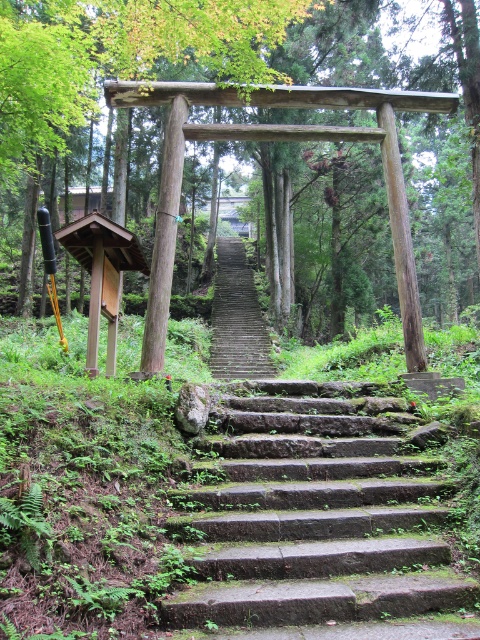
Question: Does green mossy stone stairs at center have a lesser width compared to green wood tree at center?

Choices:
 (A) yes
 (B) no

Answer: (A)

Question: Is green mossy stone stairs at center further to the viewer compared to green wood tree at center?

Choices:
 (A) yes
 (B) no

Answer: (B)

Question: Which object is the closest to the stone steps at center?

Choices:
 (A) green mossy stone stairs at center
 (B) green wood tree at center

Answer: (B)

Question: Among these points, which one is farthest from the camera?

Choices:
 (A) (350, 413)
 (B) (149, 36)

Answer: (B)

Question: Which of the following is the closest to the observer?

Choices:
 (A) (314, 536)
 (B) (243, 326)

Answer: (A)

Question: Is green mossy stone stairs at center above green wood tree at center?

Choices:
 (A) yes
 (B) no

Answer: (B)